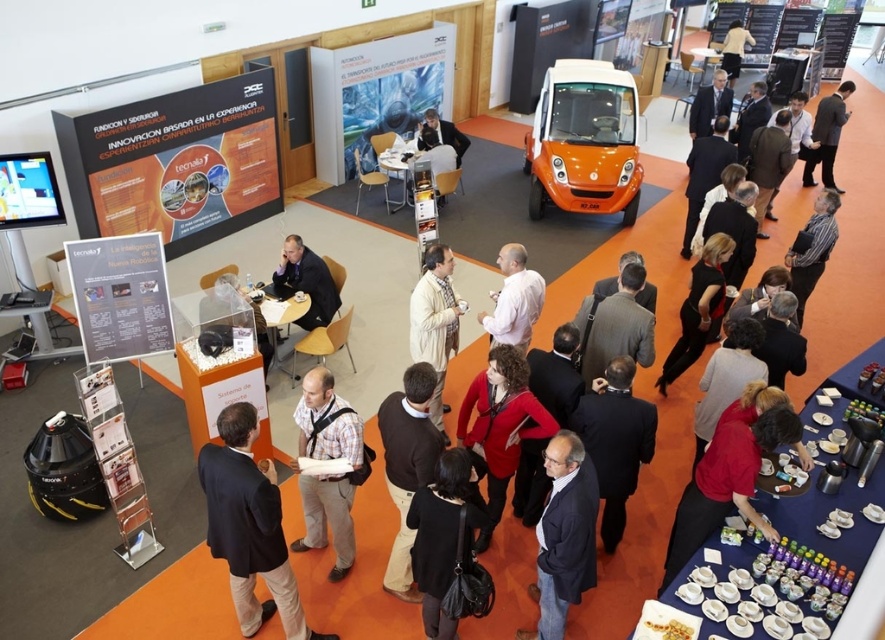
Question: Does dark brown suit at center have a smaller size compared to matte black suit at center?

Choices:
 (A) yes
 (B) no

Answer: (B)

Question: Estimate the real-world distances between objects in this image. Which object is closer to the dark brown leather jacket at center?

Choices:
 (A) white wool sweater at center
 (B) light beige shirt at upper center
 (C) dark brown suit at center

Answer: (C)

Question: Is brown sweater at center bigger than white shirt at center?

Choices:
 (A) yes
 (B) no

Answer: (A)

Question: Can you confirm if dark suit at center is thinner than black leather jacket at lower right?

Choices:
 (A) yes
 (B) no

Answer: (B)

Question: Which point is closer to the camera?

Choices:
 (A) (448, 492)
 (B) (545, 544)
 (C) (720, 67)

Answer: (A)

Question: Which point is farther to the camera?

Choices:
 (A) red matte jacket at center
 (B) brown sweater at center
 (C) light beige shirt at upper center

Answer: (C)